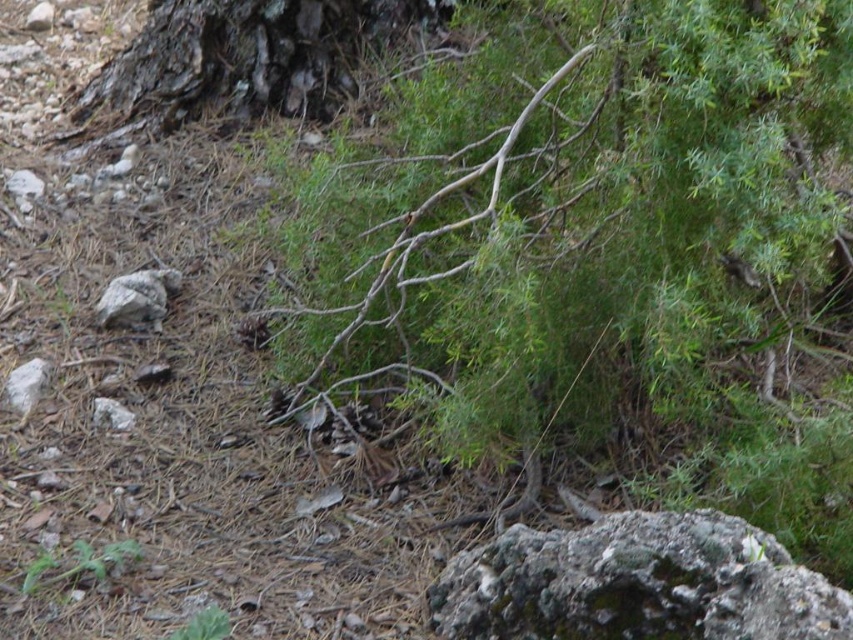
Question: Is gray rough rock at lower right bigger than dark brown bark at upper left?

Choices:
 (A) no
 (B) yes

Answer: (A)

Question: Which point is farther to the camera?

Choices:
 (A) dark brown bark at upper left
 (B) gray rough rock at lower right

Answer: (A)

Question: Is gray rough rock at lower right to the left of dark brown bark at upper left from the viewer's perspective?

Choices:
 (A) yes
 (B) no

Answer: (B)

Question: Does gray rough rock at lower right appear on the right side of dark brown bark at upper left?

Choices:
 (A) yes
 (B) no

Answer: (A)

Question: Which of the following is the closest to the observer?

Choices:
 (A) (595, 596)
 (B) (235, 120)

Answer: (A)

Question: Which object is closer to the camera taking this photo?

Choices:
 (A) gray rough rock at lower right
 (B) dark brown bark at upper left

Answer: (A)